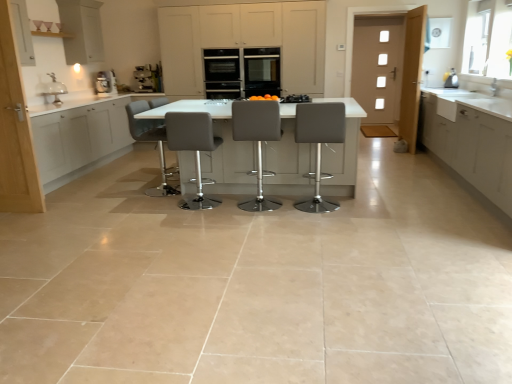
What do you see at coordinates (105, 83) in the screenshot? Image resolution: width=512 pixels, height=384 pixels. I see `metallic gray coffee machine at upper left, the 2th coffee machine when ordered from right to left` at bounding box center [105, 83].

The image size is (512, 384). Find the location of `metallic gray coffee machine at upper left, marked as the 1th coffee machine in a left-to-right arrangement`. metallic gray coffee machine at upper left, marked as the 1th coffee machine in a left-to-right arrangement is located at coordinates (105, 83).

Measure the distance between point [186,91] and camera.

A distance of 7.99 meters exists between point [186,91] and camera.

This screenshot has height=384, width=512. I want to click on white glossy table at center, so click(218, 148).

Locate an element on the screen. This screenshot has width=512, height=384. metallic silver kettle at upper right, which appears as the second appliance when viewed from the top is located at coordinates (451, 79).

Is matte gray bar stool at center, the second chair when ordered from right to left, facing away from white matte cabinet at left, the third cabinetry viewed from the left?

No, white matte cabinet at left, the third cabinetry viewed from the left, is not at the back of matte gray bar stool at center, the second chair when ordered from right to left.

Considering the points (256, 148) and (5, 75), which point is in front, point (256, 148) or point (5, 75)?

The point (5, 75) is in front.

Is matte gray bar stool at center, the second chair when ordered from right to left, at the left side of white matte cabinet at left, which is the third cabinetry in right-to-left order?

In fact, matte gray bar stool at center, the second chair when ordered from right to left, is to the right of white matte cabinet at left, which is the third cabinetry in right-to-left order.

How different are the orientations of matte white cabinets at center, the second cabinetry from the right, and white matte cabinet at left, the third cabinetry viewed from the left, in degrees?

There is a 0.000215-degree angle between the facing directions of matte white cabinets at center, the second cabinetry from the right, and white matte cabinet at left, the third cabinetry viewed from the left.

From the image's perspective, which is above, matte white cabinets at center, placed as the 4th cabinetry when sorted from left to right, or white matte cabinet at left, the third cabinetry viewed from the left?

matte white cabinets at center, placed as the 4th cabinetry when sorted from left to right.

Is matte white cabinets at center, placed as the 4th cabinetry when sorted from left to right, next to white matte cabinet at left, which is the third cabinetry in right-to-left order, and touching it?

No, matte white cabinets at center, placed as the 4th cabinetry when sorted from left to right, is not in contact with white matte cabinet at left, which is the third cabinetry in right-to-left order.

Based on the photo, considering the sizes of objects metallic gray coffee machine at upper left, marked as the 1th coffee machine in a left-to-right arrangement, and matte black oven at center, arranged as the 2th appliance when viewed from the right, in the image provided, who is taller, metallic gray coffee machine at upper left, marked as the 1th coffee machine in a left-to-right arrangement, or matte black oven at center, arranged as the 2th appliance when viewed from the right,?

With more height is matte black oven at center, arranged as the 2th appliance when viewed from the right.

Are metallic gray coffee machine at upper left, the 2th coffee machine when ordered from right to left, and matte black oven at center, arranged as the 2th appliance when viewed from the right, beside each other?

No, metallic gray coffee machine at upper left, the 2th coffee machine when ordered from right to left, is not next to matte black oven at center, arranged as the 2th appliance when viewed from the right.

Does metallic gray coffee machine at upper left, the 2th coffee machine when ordered from right to left, appear on the left side of matte black oven at center, which is counted as the first appliance, starting from the back?

Yes, metallic gray coffee machine at upper left, the 2th coffee machine when ordered from right to left, is to the left of matte black oven at center, which is counted as the first appliance, starting from the back.

Between white glossy table at center and satin silver coffee machine at center, acting as the second coffee machine starting from the left, which one is positioned behind?

satin silver coffee machine at center, acting as the second coffee machine starting from the left, is further from the camera.

Considering the points (302, 148) and (145, 73), which point is in front, point (302, 148) or point (145, 73)?

The point (302, 148) is in front.

Which is farther, (324, 128) or (439, 145)?

Positioned behind is point (439, 145).

Is grey leather stool at center, the fourth chair positioned from the left, far from white glossy cabinet at right, placed as the fifth cabinetry when sorted from left to right?

Yes, grey leather stool at center, the fourth chair positioned from the left, is far from white glossy cabinet at right, placed as the fifth cabinetry when sorted from left to right.

Can you tell me how much grey leather stool at center, which appears as the first chair when viewed from the right, and white glossy cabinet at right, placed as the fifth cabinetry when sorted from left to right, differ in facing direction?

88.1 degrees.

Which of these two, grey leather stool at center, the fourth chair positioned from the left, or white glossy cabinet at right, placed as the fifth cabinetry when sorted from left to right, stands shorter?

white glossy cabinet at right, placed as the fifth cabinetry when sorted from left to right, is shorter.

Looking at this image, is white matte cabinet at left, which is counted as the second cabinetry, starting from the left, in front of or behind satin grey bar stool at center, acting as the third chair starting from the right, in the image?

In the image, white matte cabinet at left, which is counted as the second cabinetry, starting from the left, appears behind satin grey bar stool at center, acting as the third chair starting from the right.

From the picture: How much distance is there between white matte cabinet at left, which is counted as the second cabinetry, starting from the left, and satin grey bar stool at center, acting as the third chair starting from the right?

A distance of 6.22 feet exists between white matte cabinet at left, which is counted as the second cabinetry, starting from the left, and satin grey bar stool at center, acting as the third chair starting from the right.

From the image's perspective, which one is positioned lower, white matte cabinet at left, acting as the fourth cabinetry starting from the right, or satin grey bar stool at center, acting as the third chair starting from the right?

satin grey bar stool at center, acting as the third chair starting from the right, is shown below in the image.

Which is more to the left, white matte cabinet at left, acting as the fourth cabinetry starting from the right, or satin grey bar stool at center, acting as the second chair starting from the left?

white matte cabinet at left, acting as the fourth cabinetry starting from the right.

Based on their positions, is white matte cabinet at left, acting as the fourth cabinetry starting from the right, located to the left or right of matte gray bar stool at center, the second chair when ordered from right to left?

white matte cabinet at left, acting as the fourth cabinetry starting from the right, is to the left of matte gray bar stool at center, the second chair when ordered from right to left.

Would you say matte gray bar stool at center, arranged as the 3th chair when viewed from the left, is part of white matte cabinet at left, acting as the fourth cabinetry starting from the right,'s contents?

Actually, matte gray bar stool at center, arranged as the 3th chair when viewed from the left, is outside white matte cabinet at left, acting as the fourth cabinetry starting from the right.

Consider the image. Is white matte cabinet at left, acting as the fourth cabinetry starting from the right, facing away from matte gray bar stool at center, the second chair when ordered from right to left?

No, white matte cabinet at left, acting as the fourth cabinetry starting from the right,'s orientation is not away from matte gray bar stool at center, the second chair when ordered from right to left.

Would you say white matte cabinet at left, which is counted as the second cabinetry, starting from the left, is a long distance from matte gray bar stool at center, the second chair when ordered from right to left?

That's right, there is a large distance between white matte cabinet at left, which is counted as the second cabinetry, starting from the left, and matte gray bar stool at center, the second chair when ordered from right to left.

From the matte gray bar stool at center, arranged as the 3th chair when viewed from the left, count 1st cabinetrys forward and point to it. Please provide its 2D coordinates.

[(15, 131)]

From the image's perspective, which cabinetry is the 2nd one below the matte white cabinets at center, placed as the 4th cabinetry when sorted from left to right? Please provide its 2D coordinates.

[(15, 131)]

Based on their spatial positions, is white matte cabinet at left, acting as the fourth cabinetry starting from the right, or white matte cabinet at left, which is the third cabinetry in right-to-left order, further from metallic gray coffee machine at upper left, marked as the 1th coffee machine in a left-to-right arrangement?

white matte cabinet at left, which is the third cabinetry in right-to-left order, lies further to metallic gray coffee machine at upper left, marked as the 1th coffee machine in a left-to-right arrangement, than the other object.

Which object lies further to the anchor point metallic silver kettle at upper right, the 1th appliance positioned from the bottom, matte white cabinet at upper left, the fifth cabinetry viewed from the right, or white glossy table at center?

matte white cabinet at upper left, the fifth cabinetry viewed from the right.

Estimate the real-world distances between objects in this image. Which object is closer to white glossy cabinet at right, the first cabinetry in the right-to-left sequence, matte black oven at center, which is counted as the first appliance, starting from the back, or metallic silver kettle at upper right, the 2th appliance positioned from the left?

Among the two, metallic silver kettle at upper right, the 2th appliance positioned from the left, is located nearer to white glossy cabinet at right, the first cabinetry in the right-to-left sequence.

In the scene shown: Which object lies further to the anchor point matte gray bar stool at center, the second chair when ordered from right to left, metallic silver kettle at upper right, the 1th appliance positioned from the bottom, or matte white cabinet at upper left, which is counted as the 1th cabinetry, starting from the left?

Based on the image, matte white cabinet at upper left, which is counted as the 1th cabinetry, starting from the left, appears to be further to matte gray bar stool at center, the second chair when ordered from right to left.

When comparing their distances from gray fabric stool at center, which ranks as the fourth chair in right-to-left order, does satin silver coffee machine at center, the 1th coffee machine when ordered from right to left, or white matte cabinet at left, which is counted as the second cabinetry, starting from the left, seem closer?

white matte cabinet at left, which is counted as the second cabinetry, starting from the left, is closer to gray fabric stool at center, which ranks as the fourth chair in right-to-left order.

Estimate the real-world distances between objects in this image. Which object is closer to white matte cabinet at left, acting as the fourth cabinetry starting from the right, matte white cabinet at upper left, the fifth cabinetry viewed from the right, or metallic silver kettle at upper right, which appears as the second appliance when viewed from the top?

matte white cabinet at upper left, the fifth cabinetry viewed from the right, is closer to white matte cabinet at left, acting as the fourth cabinetry starting from the right.

From the picture: Based on their spatial positions, is satin grey bar stool at center, acting as the third chair starting from the right, or white matte cabinet at left, the third cabinetry viewed from the left, closer to matte white cabinet at upper left, the fifth cabinetry viewed from the right?

The object closer to matte white cabinet at upper left, the fifth cabinetry viewed from the right, is white matte cabinet at left, the third cabinetry viewed from the left.

Looking at the image, which one is located further to white matte cabinet at left, which is the third cabinetry in right-to-left order, metallic silver kettle at upper right, the 1th appliance positioned from the bottom, or matte gray bar stool at center, the second chair when ordered from right to left?

metallic silver kettle at upper right, the 1th appliance positioned from the bottom, lies further to white matte cabinet at left, which is the third cabinetry in right-to-left order, than the other object.

This screenshot has width=512, height=384. I want to click on chair between matte gray bar stool at center, the second chair when ordered from right to left, and metallic silver kettle at upper right, which ranks as the 1th appliance in right-to-left order, in the horizontal direction, so click(319, 143).

Find the location of `table between satin grey bar stool at center, acting as the third chair starting from the right, and grey leather stool at center, which appears as the first chair when viewed from the right, in the horizontal direction`. table between satin grey bar stool at center, acting as the third chair starting from the right, and grey leather stool at center, which appears as the first chair when viewed from the right, in the horizontal direction is located at coordinates (218, 148).

The height and width of the screenshot is (384, 512). I want to click on table situated between gray fabric stool at center, which ranks as the fourth chair in right-to-left order, and metallic silver kettle at upper right, which appears as the second appliance when viewed from the top, from left to right, so [x=218, y=148].

At what (x,y) coordinates should I click in order to perform the action: click on appliance situated between matte white cabinet at upper left, the fifth cabinetry viewed from the right, and metallic silver kettle at upper right, which appears as the second appliance when viewed from the top, from left to right. Please return your answer as a coordinate pair (x, y). Image resolution: width=512 pixels, height=384 pixels. Looking at the image, I should click on (222, 73).